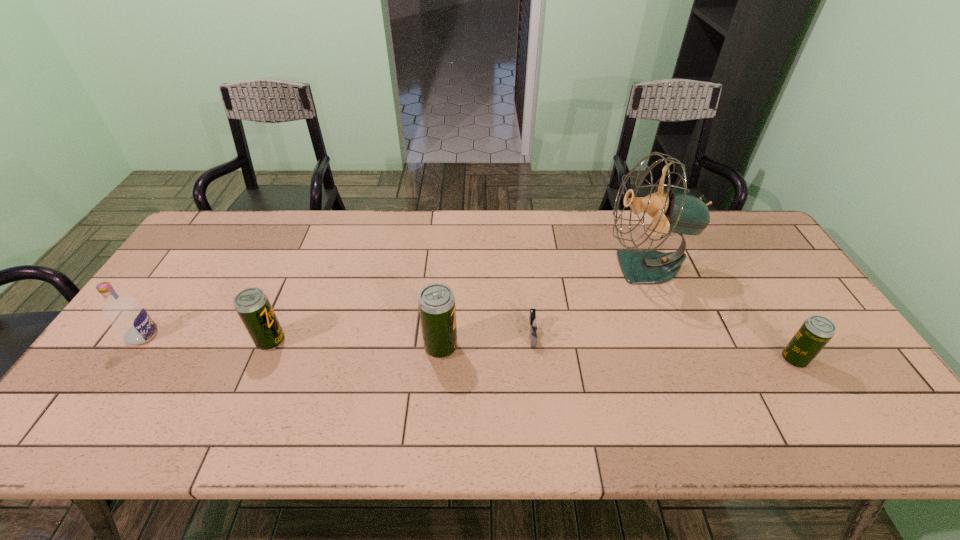
Where is `vacant space that is in between the second object from left to right and the igniter`? This screenshot has width=960, height=540. vacant space that is in between the second object from left to right and the igniter is located at coordinates (401, 338).

Where is `empty space that is in between the leftmost object and the fourth object from left to right`? Image resolution: width=960 pixels, height=540 pixels. empty space that is in between the leftmost object and the fourth object from left to right is located at coordinates (338, 335).

In order to click on vacant area that lies between the fourth object from left to right and the shortest beer can in this screenshot , I will do `click(663, 347)`.

Locate an element on the screen. empty space between the leftmost object and the second beer can from left to right is located at coordinates (292, 341).

At what (x,y) coordinates should I click in order to perform the action: click on vacant point located between the second tallest beer can and the fifth object from left to right. Please return your answer as a coordinate pair (x, y). The width and height of the screenshot is (960, 540). Looking at the image, I should click on (458, 304).

Image resolution: width=960 pixels, height=540 pixels. I want to click on free space between the second beer can from left to right and the rightmost object, so click(x=617, y=353).

Select which object is the second closest to the second shortest beer can. Please provide its 2D coordinates. Your answer should be formatted as a tuple, i.e. [(x, y)], where the tuple contains the x and y coordinates of a point satisfying the conditions above.

[(436, 302)]

The width and height of the screenshot is (960, 540). What are the coordinates of `object that can be found as the closest to the second object from left to right` in the screenshot? It's located at (124, 313).

Select which beer can is the second closest to the leftmost beer can. Please provide its 2D coordinates. Your answer should be formatted as a tuple, i.e. [(x, y)], where the tuple contains the x and y coordinates of a point satisfying the conditions above.

[(816, 331)]

Image resolution: width=960 pixels, height=540 pixels. Identify the location of the second closest beer can to the second beer can from left to right. (816, 331).